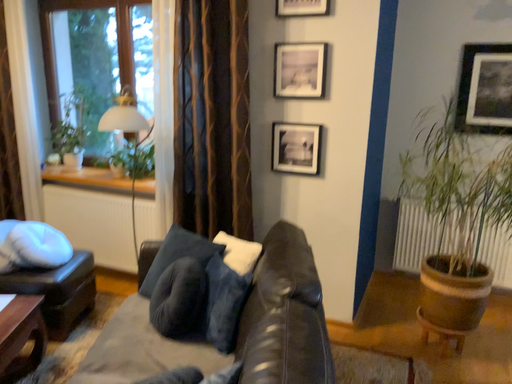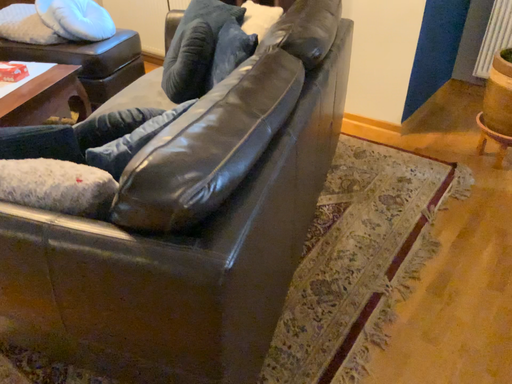
Question: How did the camera likely rotate when shooting the video?

Choices:
 (A) rotated upward
 (B) rotated downward

Answer: (B)